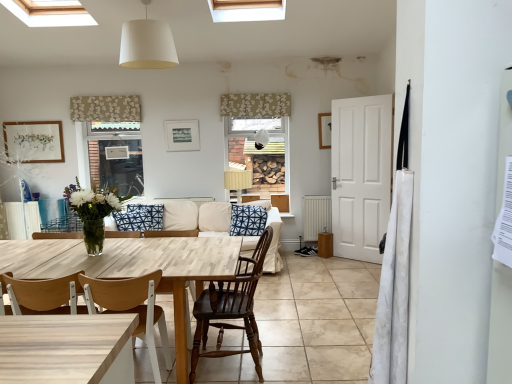
Question: Is white matte picture frame at upper center, which is the second picture frame in left-to-right order, smaller than beige floral fabric at upper left, which ranks as the 1th curtain in left-to-right order?

Choices:
 (A) yes
 (B) no

Answer: (A)

Question: Can you confirm if white matte picture frame at upper center, which is the second picture frame in left-to-right order, is thinner than beige floral fabric at upper left, which ranks as the 1th curtain in left-to-right order?

Choices:
 (A) yes
 (B) no

Answer: (A)

Question: Does white matte picture frame at upper center, which is the second picture frame in left-to-right order, come behind beige floral fabric at upper left, arranged as the first curtain when viewed from the back?

Choices:
 (A) yes
 (B) no

Answer: (A)

Question: Does white matte picture frame at upper center, which is the second picture frame in left-to-right order, appear on the right side of beige floral fabric at upper left, arranged as the first curtain when viewed from the back?

Choices:
 (A) no
 (B) yes

Answer: (B)

Question: Is beige floral fabric at upper left, arranged as the first curtain when viewed from the back, inside white matte picture frame at upper center, which is the second picture frame in left-to-right order?

Choices:
 (A) yes
 (B) no

Answer: (B)

Question: Does white matte picture frame at upper center, which is the second picture frame in left-to-right order, have a lesser height compared to beige floral fabric at upper left, the 3th curtain positioned from the right?

Choices:
 (A) no
 (B) yes

Answer: (A)

Question: Is white fabric curtain at right, the 3th curtain from the back, behind beige fabric couch at center?

Choices:
 (A) no
 (B) yes

Answer: (A)

Question: Considering the relative sizes of white fabric curtain at right, arranged as the 1th curtain when viewed from the front, and beige fabric couch at center in the image provided, is white fabric curtain at right, arranged as the 1th curtain when viewed from the front, taller than beige fabric couch at center?

Choices:
 (A) no
 (B) yes

Answer: (B)

Question: Is white fabric curtain at right, arranged as the first curtain when viewed from the right, oriented towards beige fabric couch at center?

Choices:
 (A) yes
 (B) no

Answer: (B)

Question: Is white fabric curtain at right, the third curtain from the left, to the right of beige fabric couch at center from the viewer's perspective?

Choices:
 (A) yes
 (B) no

Answer: (A)

Question: Is white fabric curtain at right, arranged as the 1th curtain when viewed from the front, positioned with its back to beige fabric couch at center?

Choices:
 (A) no
 (B) yes

Answer: (A)

Question: Can you confirm if white fabric curtain at right, acting as the first curtain starting from the bottom, is wider than beige fabric couch at center?

Choices:
 (A) yes
 (B) no

Answer: (B)

Question: Is the position of white fabric lampshade at upper center, which is the third lamp in bottom-to-top order, more distant than that of white matte picture frame at upper center, which is the second picture frame in left-to-right order?

Choices:
 (A) no
 (B) yes

Answer: (A)